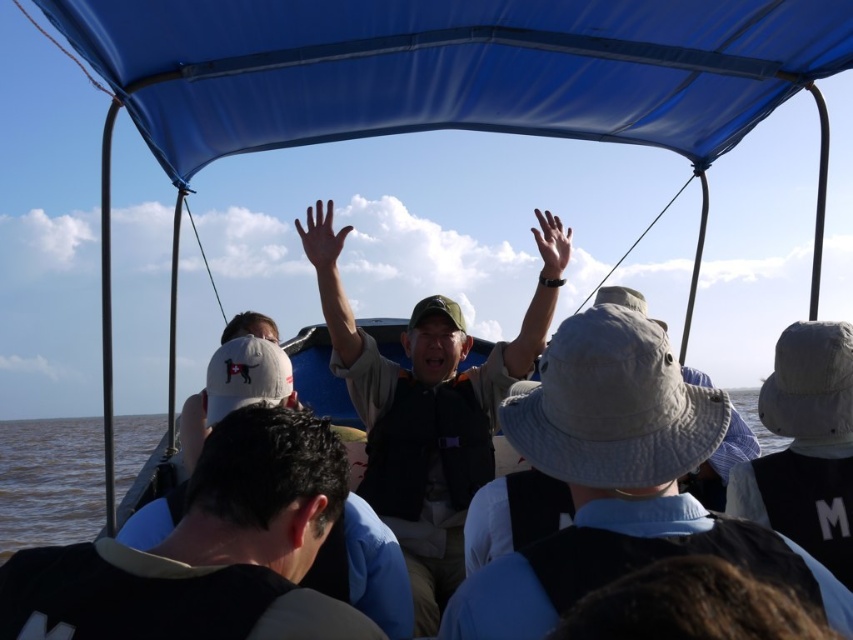
Question: Can you confirm if blue fabric canopy at upper center is positioned above brown water at lower left?

Choices:
 (A) no
 (B) yes

Answer: (B)

Question: Is blue fabric canopy at upper center wider than brown water at lower left?

Choices:
 (A) yes
 (B) no

Answer: (B)

Question: Which object appears farthest from the camera in this image?

Choices:
 (A) brown water at lower left
 (B) blue fabric canopy at upper center

Answer: (A)

Question: Can you confirm if blue fabric canopy at upper center is bigger than brown water at lower left?

Choices:
 (A) yes
 (B) no

Answer: (B)